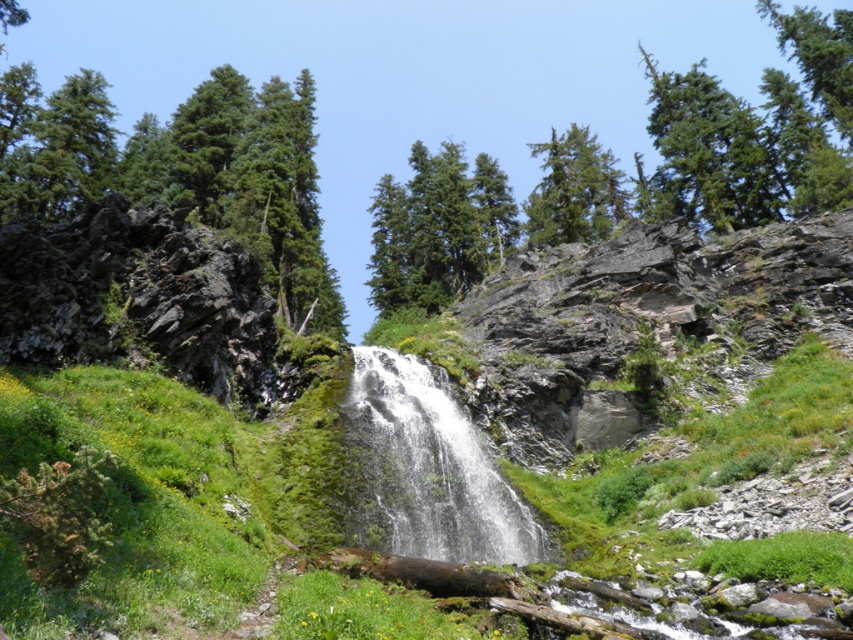
Can you confirm if green mossy hillside at center is taller than green matte tree at upper center?

No.

Describe the element at coordinates (663, 371) in the screenshot. I see `green mossy hillside at center` at that location.

Which is behind, point (666, 236) or point (541, 144)?

Point (541, 144)

Where is `green mossy hillside at center`? Image resolution: width=853 pixels, height=640 pixels. green mossy hillside at center is located at coordinates (663, 371).

Who is higher up, green evergreen tree at upper center or brown rough log at center?

green evergreen tree at upper center is higher up.

Who is more forward, (451, 172) or (489, 579)?

Point (489, 579)

What are the coordinates of `green evergreen tree at upper center` in the screenshot? It's located at (437, 228).

Find the location of a particular element. white frothy water at center is located at coordinates (431, 468).

Is white frothy water at center wider than green matte tree at upper center?

In fact, white frothy water at center might be narrower than green matte tree at upper center.

Who is more distant from viewer, (358, 420) or (529, 236)?

The point (529, 236) is behind.

Where is `white frothy water at center`? white frothy water at center is located at coordinates (431, 468).